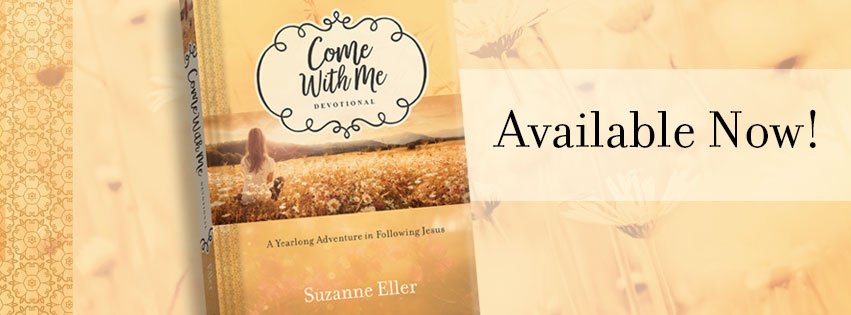
Locate an element on the screen. The image size is (851, 315). wall paper pattern is located at coordinates (43, 84).